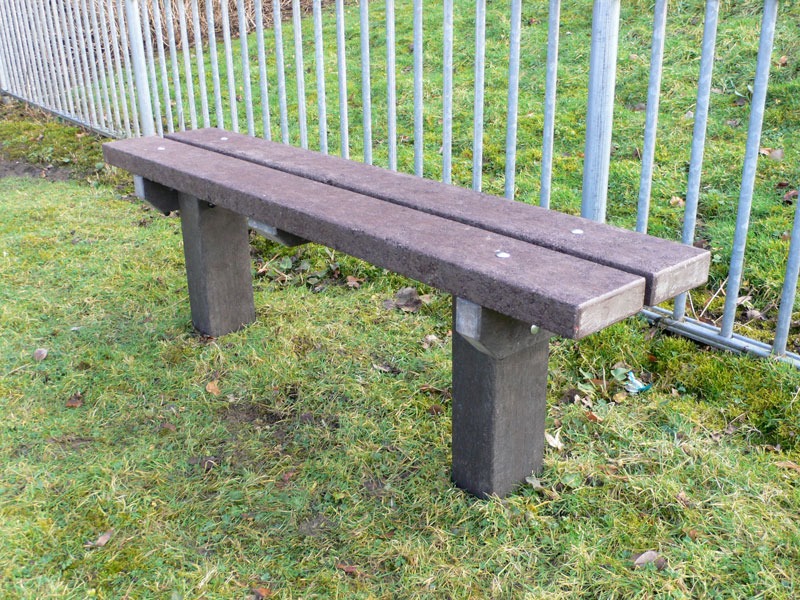
The image size is (800, 600). What are the coordinates of `planks` in the screenshot? It's located at (352, 225), (452, 194).